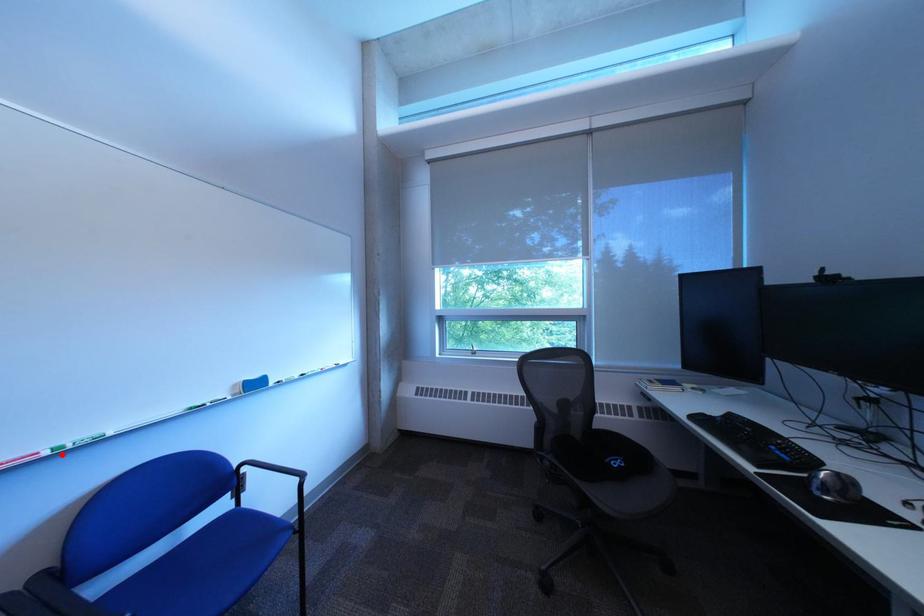
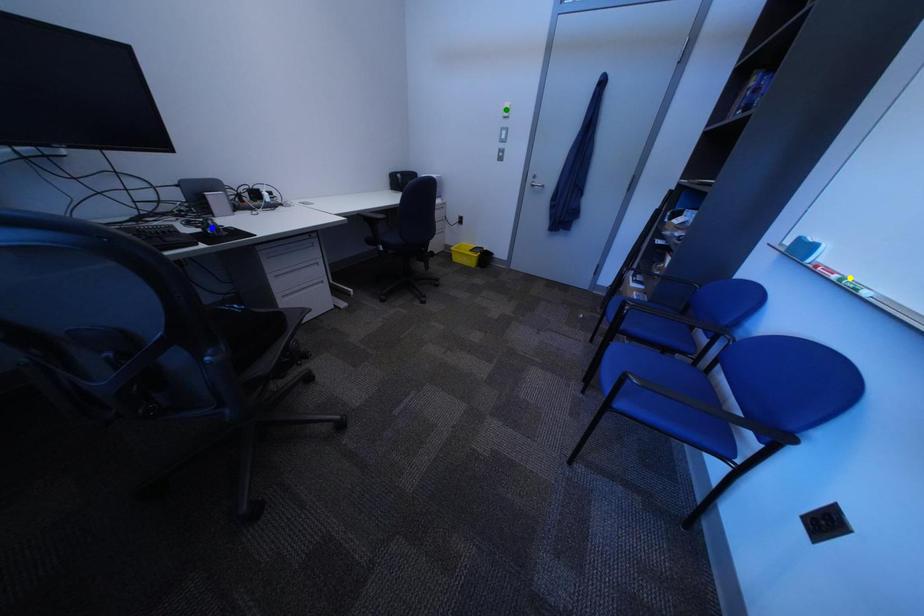
Question: I am providing you with two images of the same scene from different viewpoints. A red point is marked on the first image. You are given multiple points on the second image. Which mark in image 2 goes with the point in image 1?

Choices:
 (A) green point
 (B) blue point
 (C) yellow point

Answer: (C)